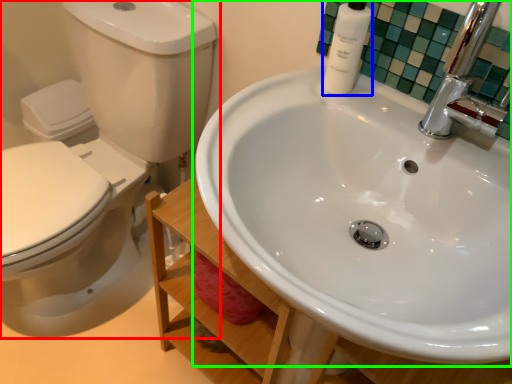
Question: Which object is positioned closest to toilet (highlighted by a red box)? Select from toiletry (highlighted by a blue box) and sink (highlighted by a green box).

Choices:
 (A) toiletry
 (B) sink

Answer: (B)